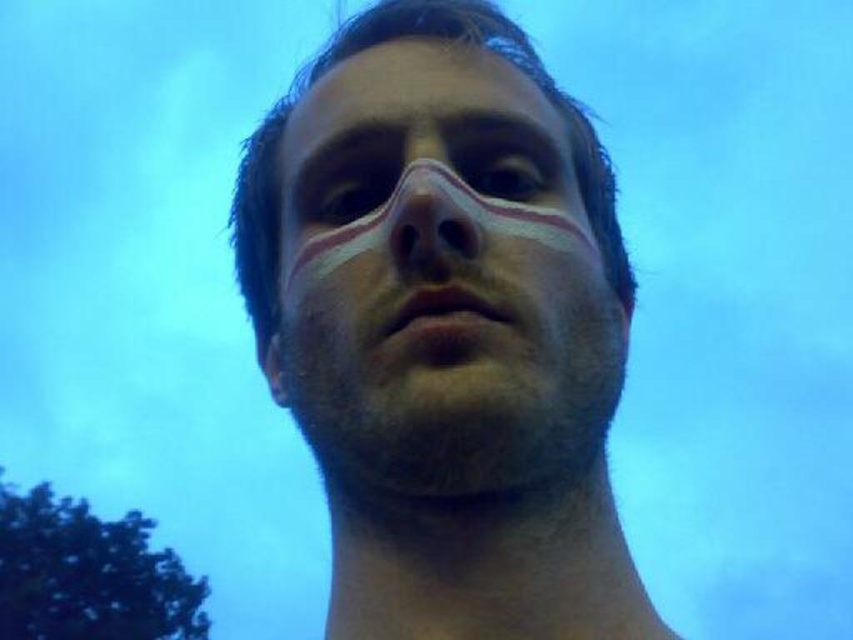
Question: Which point is closer to the camera taking this photo?

Choices:
 (A) (387, 68)
 (B) (546, 118)

Answer: (A)

Question: Is white matte face at center smaller than smooth skin neck at center?

Choices:
 (A) yes
 (B) no

Answer: (B)

Question: Where is smooth skin neck at center located in relation to smooth skin nose at center in the image?

Choices:
 (A) right
 (B) left

Answer: (A)

Question: Can you confirm if smooth skin nose at center is positioned above brown matte eyebrow at upper center?

Choices:
 (A) no
 (B) yes

Answer: (A)

Question: Which point appears closest to the camera in this image?

Choices:
 (A) (532, 180)
 (B) (492, 147)

Answer: (B)

Question: Which point appears farthest from the camera in this image?

Choices:
 (A) (468, 51)
 (B) (363, 205)
 (C) (508, 156)

Answer: (A)